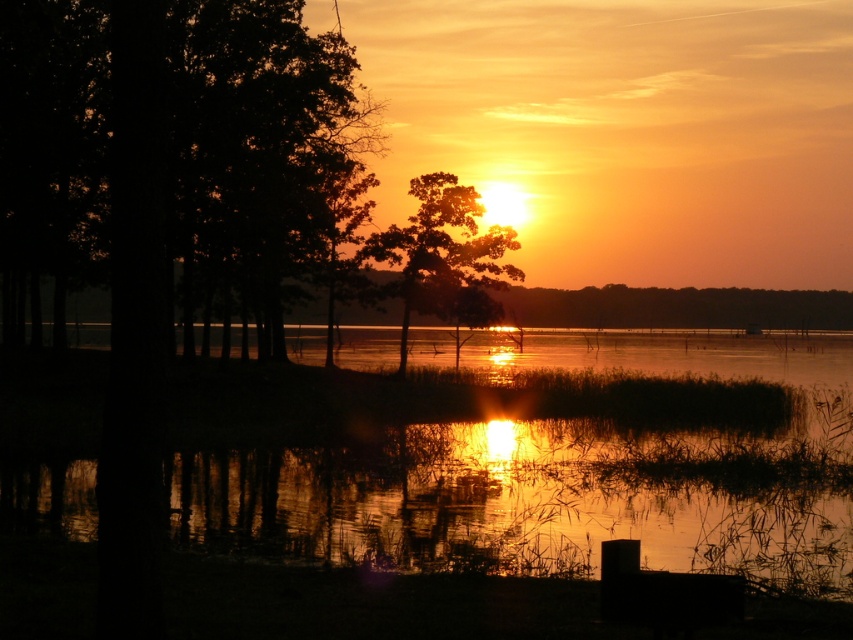
Question: Does glistening reflective water at center have a larger size compared to dark brown wood trees at left?

Choices:
 (A) no
 (B) yes

Answer: (A)

Question: Which point is farther to the camera?

Choices:
 (A) (276, 257)
 (B) (614, 438)

Answer: (A)

Question: Among these objects, which one is nearest to the camera?

Choices:
 (A) glistening reflective water at center
 (B) silhouette tree at center
 (C) dark brown wood trees at left

Answer: (C)

Question: Which point appears closest to the camera in this image?

Choices:
 (A) (416, 184)
 (B) (80, 504)
 (C) (13, 150)

Answer: (B)

Question: Can you confirm if glistening reflective water at center is wider than silhouette tree at center?

Choices:
 (A) no
 (B) yes

Answer: (B)

Question: Does glistening reflective water at center lie in front of dark brown wood trees at left?

Choices:
 (A) no
 (B) yes

Answer: (A)